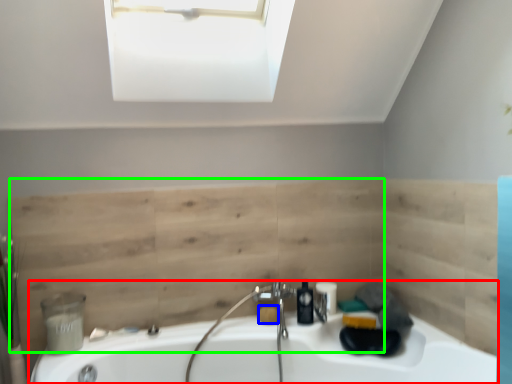
Question: Considering the real-world distances, which object is closest to bathtub (highlighted by a red box)? soap (highlighted by a blue box) or plywood (highlighted by a green box).

Choices:
 (A) soap
 (B) plywood

Answer: (B)